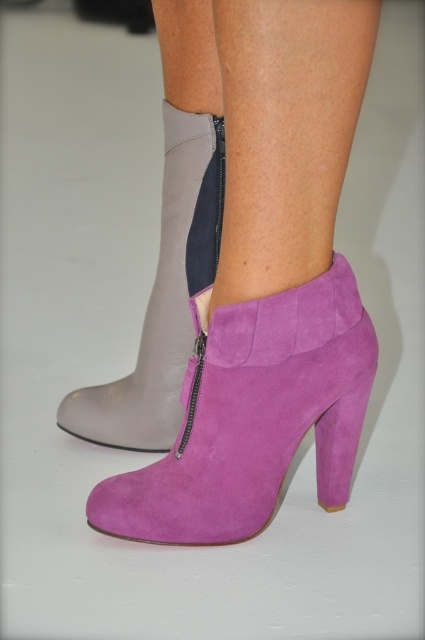
Describe the element at coordinates (164, 296) in the screenshot. I see `suede boot at center` at that location.

Is suede boot at center behind purple suede heel at lower right?

No.

Is point (167, 372) farther from viewer compared to point (323, 502)?

Yes, it is.

Image resolution: width=425 pixels, height=640 pixels. I want to click on suede boot at center, so click(164, 296).

Does purple suede boot at lower right have a larger size compared to purple suede heel at lower right?

Yes.

The image size is (425, 640). Describe the element at coordinates (243, 275) in the screenshot. I see `purple suede boot at lower right` at that location.

Which is behind, point (255, 232) or point (340, 504)?

Positioned behind is point (340, 504).

Identify the location of purple suede boot at lower right. This screenshot has width=425, height=640. (243, 275).

Who is higher up, suede purple boot at lower right or purple suede heel at lower right?

suede purple boot at lower right is higher up.

Which is in front, point (331, 362) or point (337, 506)?

Point (331, 362) is more forward.

Where is `suede purple boot at lower right`? suede purple boot at lower right is located at coordinates (252, 417).